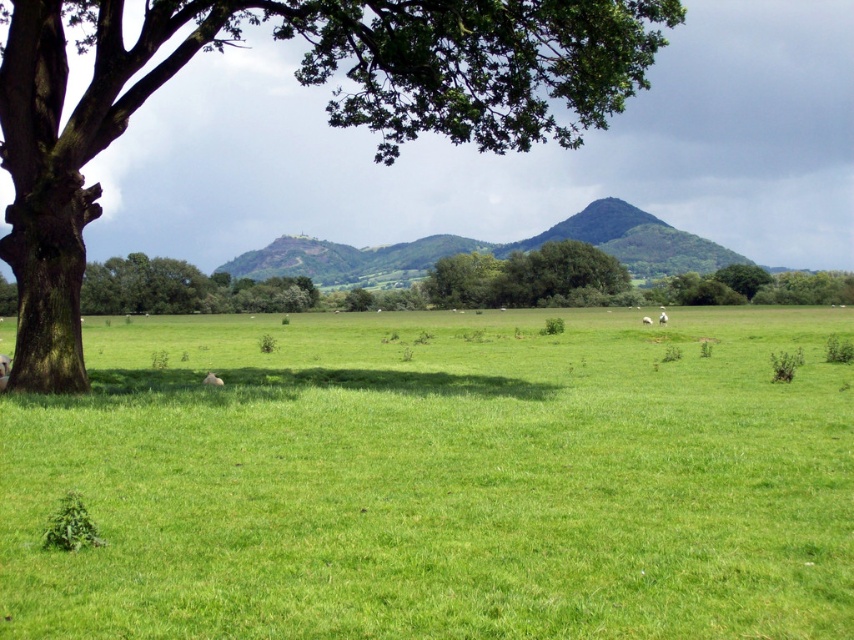
You are a farmer checking your field. You see the green leafy tree at left and the white fluffy sheep at center. Which one takes up more space in the image?

The green leafy tree at left is bigger than the white fluffy sheep at center, so it takes up more space in the image.

You are a farmer standing at the edge of the field looking towards the center of the image. You see the green textured hill at center and the white fluffy sheep at center. Which object is closer to you?

The green textured hill at center is closer to you because the white fluffy sheep at center is behind it.

You are standing at the point marked by the coordinate point [439,480] in the image. What is the name of the object you are currently standing on?

The point [439,480] corresponds to the green grass pasture at center, so you are standing on the green grass pasture at center.